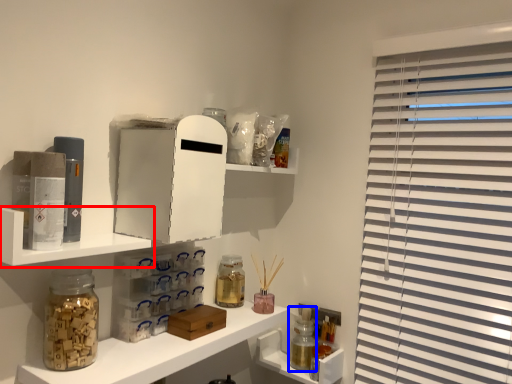
Question: Which point is further to the camera, shelf (highlighted by a red box) or bottle (highlighted by a blue box)?

Choices:
 (A) shelf
 (B) bottle

Answer: (B)